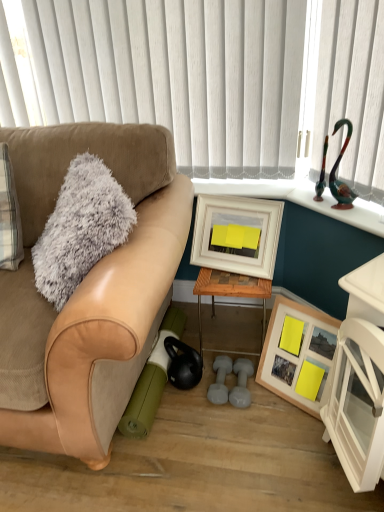
Question: Considering the positions of white vertical blinds at upper center and fuzzy gray throw pillow at left in the image, is white vertical blinds at upper center taller or shorter than fuzzy gray throw pillow at left?

Choices:
 (A) tall
 (B) short

Answer: (A)

Question: Considering the relative positions of white vertical blinds at upper center and fuzzy gray throw pillow at left in the image provided, is white vertical blinds at upper center to the left or to the right of fuzzy gray throw pillow at left?

Choices:
 (A) right
 (B) left

Answer: (A)

Question: Which object is positioned farthest from the white vertical blinds at upper center?

Choices:
 (A) woodenmaterial/texturetable at center
 (B) wooden framed picture at lower right, which appears as the second picture frame when viewed from the top
 (C) fuzzy gray throw pillow at left
 (D) suede tan couch at left
 (E) white wooden picture frame at center, the 1th picture frame positioned from the top

Answer: (B)

Question: Which object is the closest to the wooden framed picture at lower right, acting as the first picture frame starting from the bottom?

Choices:
 (A) fuzzy gray throw pillow at left
 (B) white wooden picture frame at center, marked as the second picture frame in a bottom-to-top arrangement
 (C) woodenmaterial/texturetable at center
 (D) white vertical blinds at upper center
 (E) suede tan couch at left

Answer: (C)